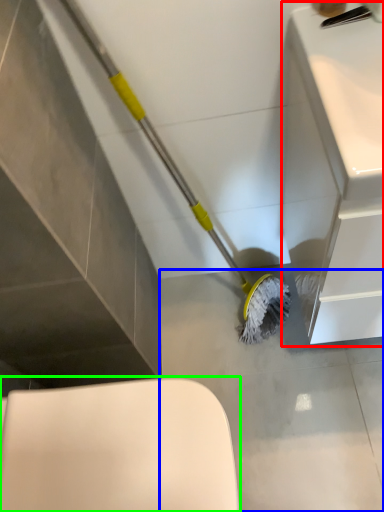
Question: Which object is positioned farthest from counter top (highlighted by a red box)? Select from concrete (highlighted by a blue box) and toilet (highlighted by a green box).

Choices:
 (A) concrete
 (B) toilet

Answer: (B)